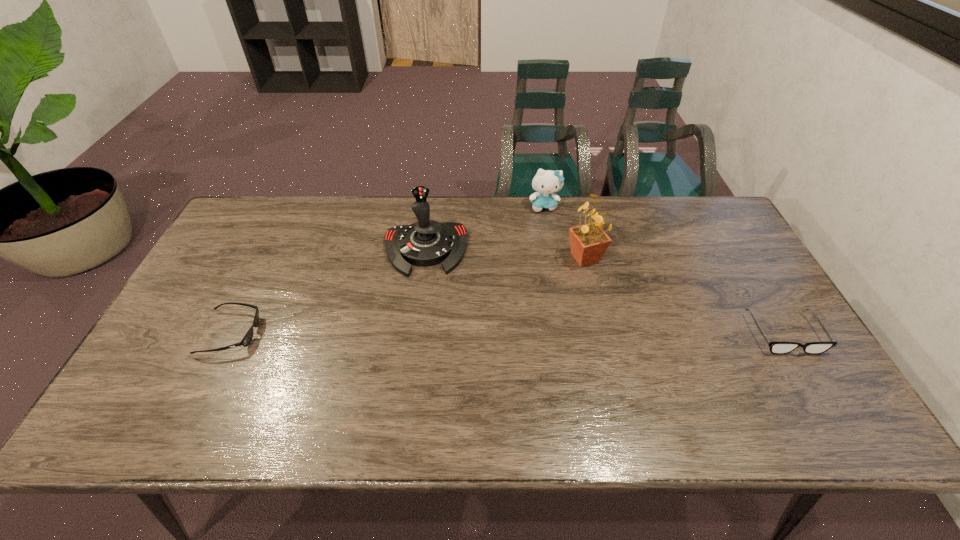
You are a GUI agent. You are given a task and a screenshot of the screen. Output one action in this format:
    pyautogui.click(x=<x>, y=<y>)
    Task: Click on the free space on the desktop that is between the shortest object and the spectacles and is positioned at the front of the sunflower with flowers visible
    This screenshot has height=540, width=960.
    Given the screenshot: What is the action you would take?
    pyautogui.click(x=551, y=333)

This screenshot has width=960, height=540. What are the coordinates of `vacant space on the desktop that is between the shortest object and the rightmost object and is positioned on the handle side of the joystick` in the screenshot? It's located at (428, 333).

Image resolution: width=960 pixels, height=540 pixels. In order to click on free space on the desktop that is between the shortest object and the spectacles and is positioned on the face of the kitten in this screenshot , I will do `click(576, 333)`.